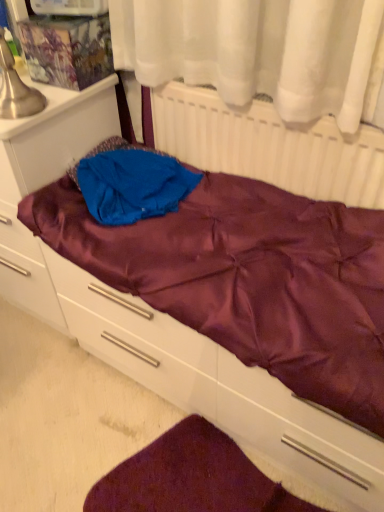
Question: Is velvety maroon mat at lower center in contact with white matte radiator at upper center?

Choices:
 (A) yes
 (B) no

Answer: (B)

Question: Is velvety maroon mat at lower center at the left side of white matte radiator at upper center?

Choices:
 (A) yes
 (B) no

Answer: (A)

Question: Are velvety maroon mat at lower center and white matte radiator at upper center located far from each other?

Choices:
 (A) no
 (B) yes

Answer: (A)

Question: From a real-world perspective, is velvety maroon mat at lower center under white matte radiator at upper center?

Choices:
 (A) yes
 (B) no

Answer: (A)

Question: Does velvety maroon mat at lower center lie behind white matte radiator at upper center?

Choices:
 (A) no
 (B) yes

Answer: (A)

Question: Is point (266, 155) positioned closer to the camera than point (155, 199)?

Choices:
 (A) farther
 (B) closer

Answer: (B)

Question: Based on their positions, is white matte radiator at upper center located to the left or right of blue fabric at center?

Choices:
 (A) left
 (B) right

Answer: (B)

Question: In the image, is white matte radiator at upper center positioned in front of or behind blue fabric at center?

Choices:
 (A) behind
 (B) front

Answer: (B)

Question: Which is correct: white matte radiator at upper center is inside blue fabric at center, or outside of it?

Choices:
 (A) inside
 (B) outside

Answer: (B)

Question: Is blue fabric at center wider or thinner than white matte radiator at upper center?

Choices:
 (A) thin
 (B) wide

Answer: (B)

Question: From a real-world perspective, is blue fabric at center positioned above or below white matte radiator at upper center?

Choices:
 (A) above
 (B) below

Answer: (B)

Question: Looking at the image, does blue fabric at center seem bigger or smaller compared to white matte radiator at upper center?

Choices:
 (A) big
 (B) small

Answer: (B)

Question: Is point (92, 173) positioned closer to the camera than point (339, 163)?

Choices:
 (A) closer
 (B) farther

Answer: (B)

Question: From a real-world perspective, relative to satin purple file cabinet at left, is blue fabric at center vertically above or below?

Choices:
 (A) above
 (B) below

Answer: (A)

Question: Considering the positions of blue fabric at center and satin purple file cabinet at left in the image, is blue fabric at center wider or thinner than satin purple file cabinet at left?

Choices:
 (A) thin
 (B) wide

Answer: (A)